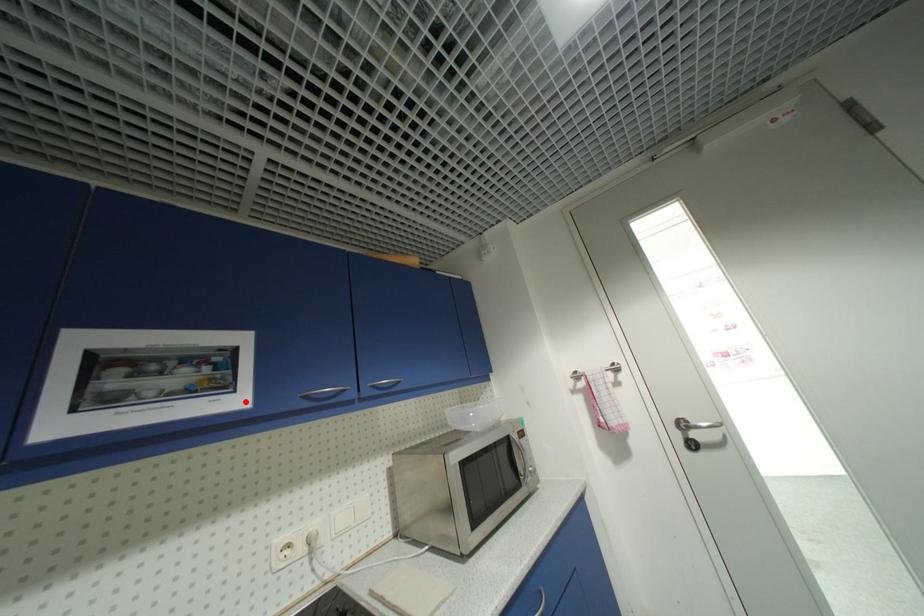
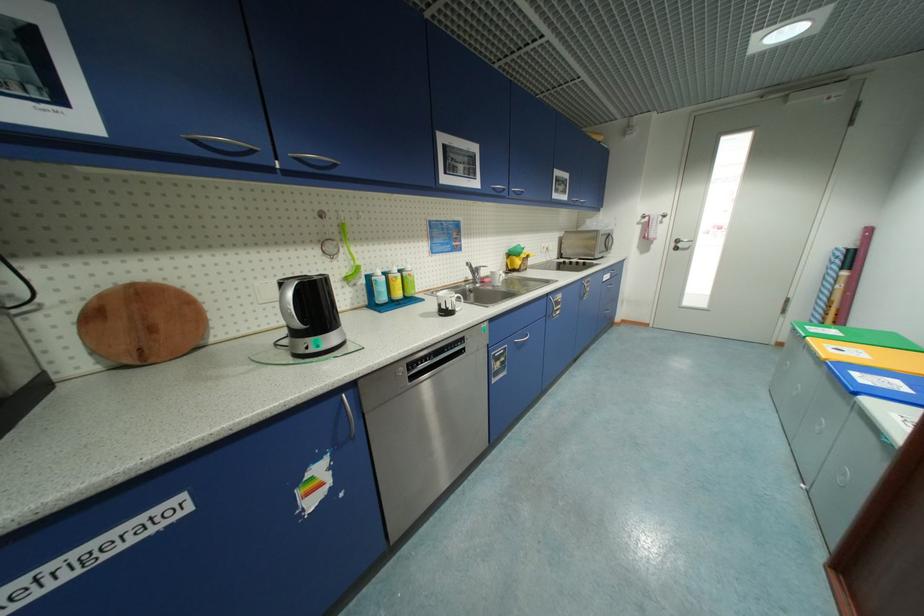
The point at the highlighted location is marked in the first image. Where is the corresponding point in the second image?

(570, 199)